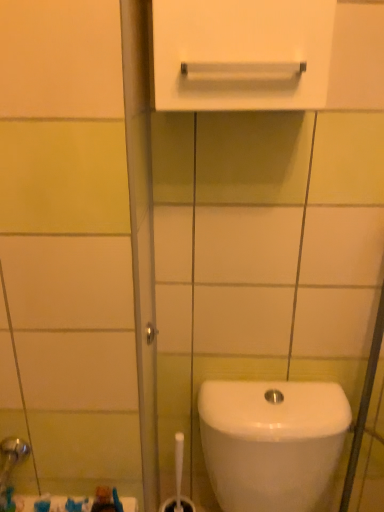
Question: In the image, is white glossy toilet at lower right positioned in front of or behind white plastic brush at lower center?

Choices:
 (A) behind
 (B) front

Answer: (B)

Question: From a real-world perspective, is white glossy toilet at lower right above or below white plastic brush at lower center?

Choices:
 (A) below
 (B) above

Answer: (B)

Question: Which is nearer to the white glossy toilet at lower right?

Choices:
 (A) white glossy towel bar at upper center
 (B) white plastic brush at lower center

Answer: (B)

Question: Considering the real-world distances, which object is farthest from the white glossy towel bar at upper center?

Choices:
 (A) white glossy toilet at lower right
 (B) white plastic brush at lower center

Answer: (B)